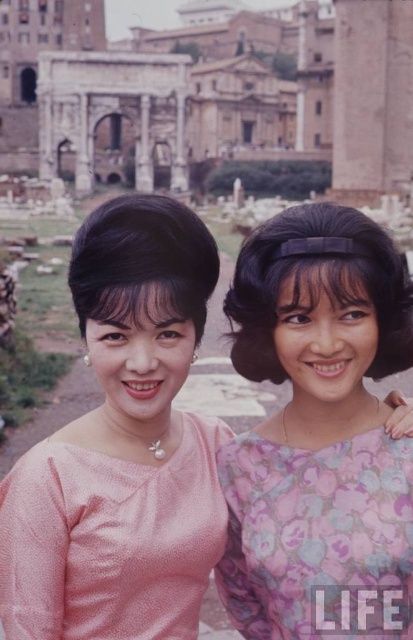
Question: Which object is the farthest from the pink floral dress at center?

Choices:
 (A) pink textured dress at center
 (B) pink satin dress at center

Answer: (A)

Question: Which point is closer to the camera?

Choices:
 (A) (168, 483)
 (B) (47, 516)

Answer: (B)

Question: Can you confirm if pink floral dress at center is positioned to the right of pink textured dress at center?

Choices:
 (A) yes
 (B) no

Answer: (A)

Question: Observing the image, what is the correct spatial positioning of pink floral dress at center in reference to pink satin dress at center?

Choices:
 (A) left
 (B) right

Answer: (B)

Question: Is pink floral dress at center positioned behind pink satin dress at center?

Choices:
 (A) no
 (B) yes

Answer: (B)

Question: Which object appears farthest from the camera in this image?

Choices:
 (A) pink satin dress at center
 (B) pink floral dress at center

Answer: (B)